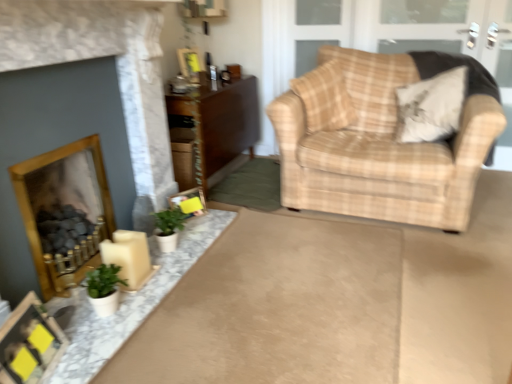
Question: Is point (194, 77) closer or farther from the camera than point (66, 160)?

Choices:
 (A) closer
 (B) farther

Answer: (B)

Question: Considering the positions of wooden picture frame at upper center, positioned as the first picture frame in back-to-front order, and wooden fireplace at lower left, the first fireplace from the back, in the image, is wooden picture frame at upper center, positioned as the first picture frame in back-to-front order, taller or shorter than wooden fireplace at lower left, the first fireplace from the back,?

Choices:
 (A) short
 (B) tall

Answer: (A)

Question: Estimate the real-world distances between objects in this image. Which object is farther from the matte gold fireplace at left, which ranks as the first fireplace in front-to-back order?

Choices:
 (A) beige fabric pillow at upper right, the 2th pillow when ordered from left to right
 (B) wooden picture frame at upper center, positioned as the first picture frame in back-to-front order
 (C) plaid fabric pillow at upper right, placed as the second pillow when sorted from right to left
 (D) brown wood cabinet at center
 (E) matte yellow picture frame at lower center, the first picture frame when ordered from right to left

Answer: (A)

Question: Based on their relative distances, which object is nearer to the green matte plant at lower left, which is counted as the 1th houseplant, starting from the back?

Choices:
 (A) beige plaid armchair at right
 (B) green matte plant at lower left, which appears as the first houseplant when viewed from the front
 (C) brown wood cabinet at center
 (D) matte gold fireplace at left, placed as the 2th fireplace when sorted from back to front
 (E) wooden picture frame at upper center, which appears as the 3th picture frame when viewed from the front

Answer: (B)